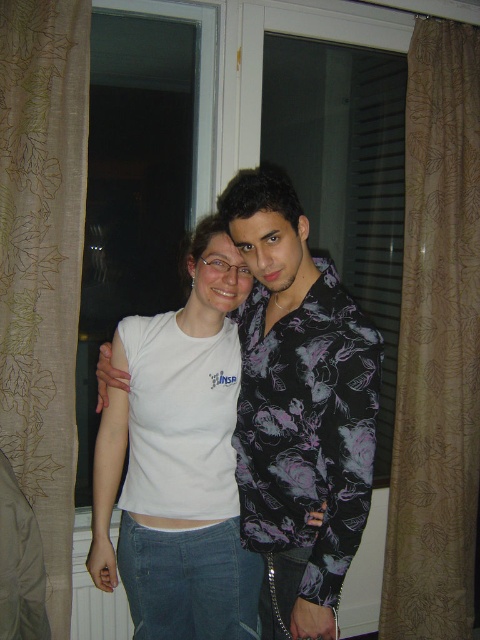
Question: Which of these objects is positioned closest to the brown textured curtain at left?

Choices:
 (A) white matte t-shirt at center
 (B) brown textured curtain at right

Answer: (A)

Question: Which object appears farthest from the camera in this image?

Choices:
 (A) brown textured curtain at right
 (B) white matte t-shirt at center
 (C) brown textured curtain at left

Answer: (A)

Question: Does white matte t-shirt at center have a lesser width compared to brown textured curtain at left?

Choices:
 (A) yes
 (B) no

Answer: (B)

Question: Where is white matte t-shirt at center located in relation to brown textured curtain at right in the image?

Choices:
 (A) above
 (B) below

Answer: (B)

Question: Where is white matte t-shirt at center located in relation to brown textured curtain at left in the image?

Choices:
 (A) below
 (B) above

Answer: (A)

Question: Which point is closer to the camera?

Choices:
 (A) (432, 524)
 (B) (345, 408)
 (C) (25, 179)

Answer: (B)